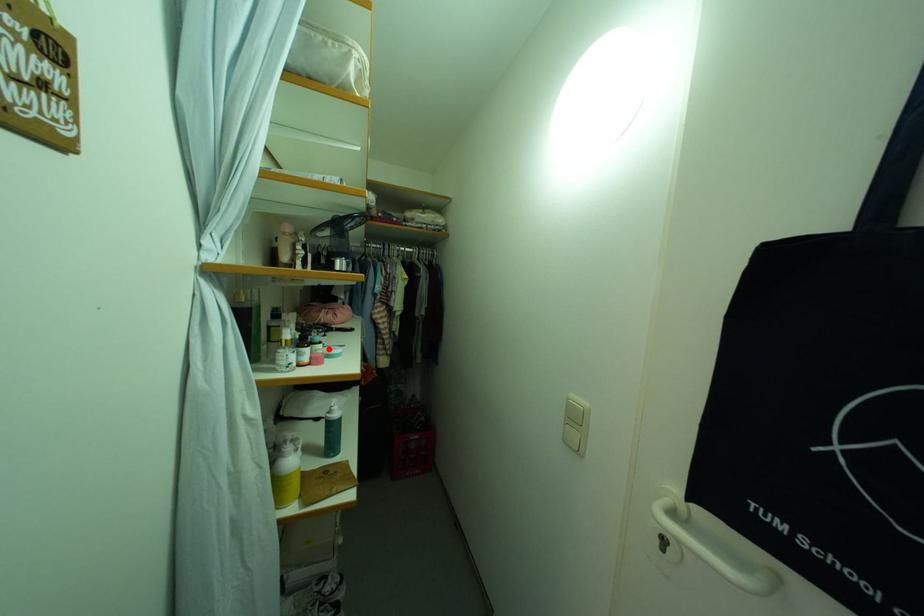
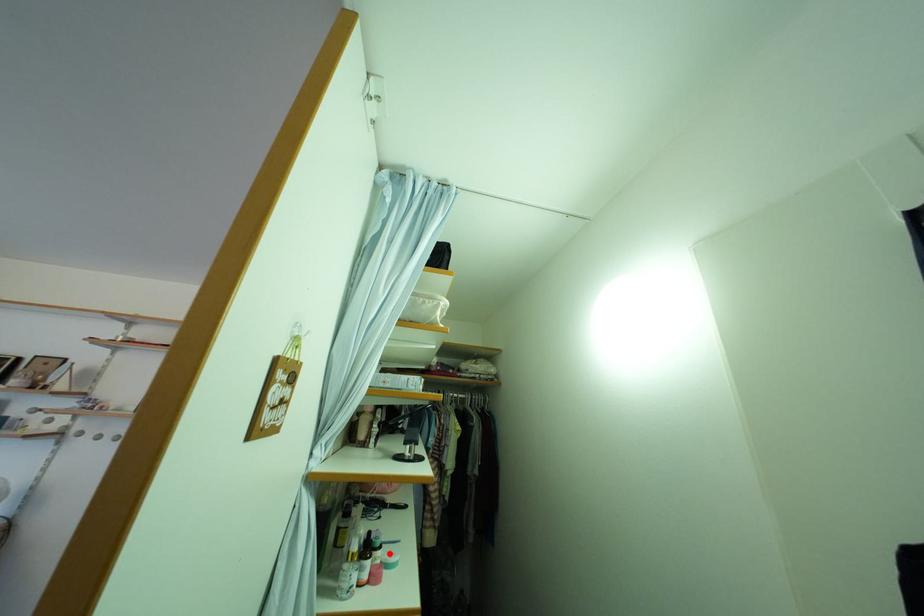
I am providing you with two images of the same scene from different viewpoints. A red point is marked on the first image and another point is marked on the second image. Is the marked point in image1 the same physical position as the marked point in image2?

Yes